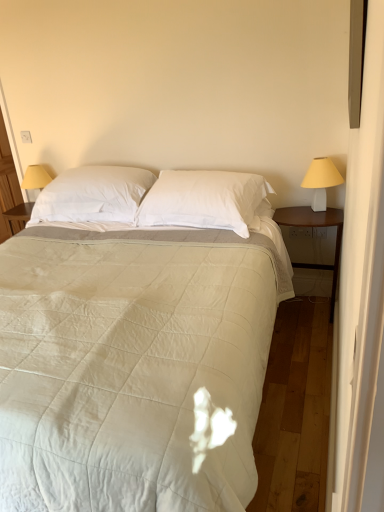
I want to click on vacant space that is to the left of white plastic lampshade at right, so click(x=294, y=212).